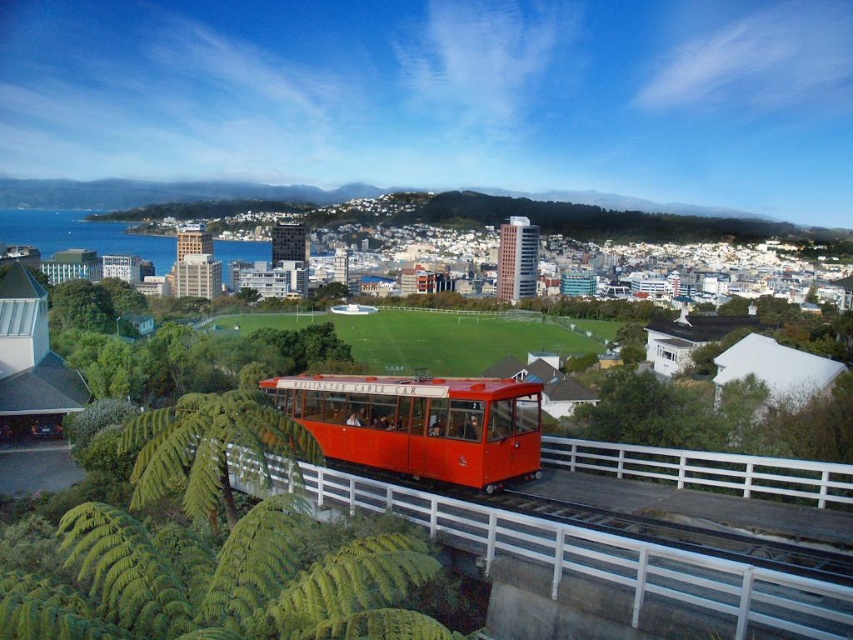
You are standing at the Wellington Cable Car and want to determine which of the two points, point (x=717, y=458) or point (x=326, y=392), is nearer to you. Based on the scene description, which point is closer?

Point (x=717, y=458) is closer to the viewer than point (x=326, y=392).

You are a passenger on the shiny red cable car at center. You notice the white metal rail at center below you. Can you confirm if the cable car is currently above or below the rail?

The shiny red cable car at center is positioned over the white metal rail at center, so the cable car is above the rail.

You are standing at the Wellington Cable Car and want to determine the relative positions of two points in the scene. Which of the two points, point (416, 451) or point (643, 470), is closer to you?

Point (416, 451) is further to the viewer than point (643, 470), so the point closer to you is point (643, 470).